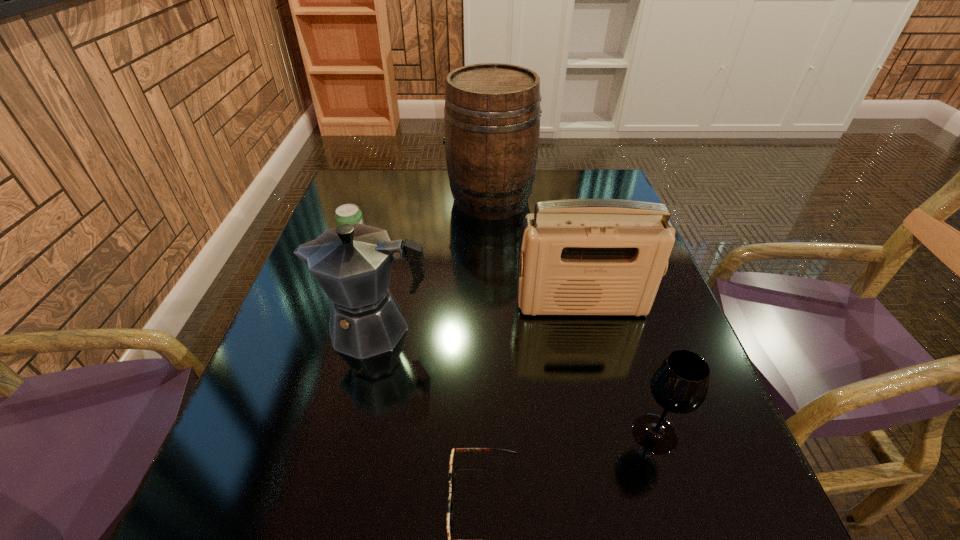
In the image, there is a desktop. Where is `vacant region at the near edge`? The height and width of the screenshot is (540, 960). vacant region at the near edge is located at coordinates 476,523.

Image resolution: width=960 pixels, height=540 pixels. What are the coordinates of `vacant region at the left edge of the desktop` in the screenshot? It's located at (307, 276).

At what (x,y) coordinates should I click in order to perform the action: click on vacant space at the far left corner of the desktop. Please return your answer as a coordinate pair (x, y). The height and width of the screenshot is (540, 960). Looking at the image, I should click on (366, 180).

The height and width of the screenshot is (540, 960). I want to click on free point between the radio receiver and the coffeepot, so click(478, 316).

In order to click on object that stands as the fifth closest to the shortest object in this screenshot , I will do tap(492, 111).

The image size is (960, 540). I want to click on object that can be found as the closest to the radio receiver, so click(352, 263).

This screenshot has width=960, height=540. In order to click on free location that satisfies the following two spatial constraints: 1. on the side of the wineglass near the bung hole; 2. on the left side of the tallest object in this screenshot , I will do `click(498, 434)`.

Where is `free space that satisfies the following two spatial constraints: 1. on the front-facing side of the radio receiver; 2. at the spout of the coffeepot`? Image resolution: width=960 pixels, height=540 pixels. free space that satisfies the following two spatial constraints: 1. on the front-facing side of the radio receiver; 2. at the spout of the coffeepot is located at coordinates (588, 328).

Where is `vacant region that satisfies the following two spatial constraints: 1. on the front-facing side of the radio receiver; 2. at the spout of the coffeepot`? Image resolution: width=960 pixels, height=540 pixels. vacant region that satisfies the following two spatial constraints: 1. on the front-facing side of the radio receiver; 2. at the spout of the coffeepot is located at coordinates (588, 328).

Locate an element on the screen. The image size is (960, 540). free spot that satisfies the following two spatial constraints: 1. on the front side of the second nearest object; 2. on the right side of the fifth tallest object is located at coordinates (295, 434).